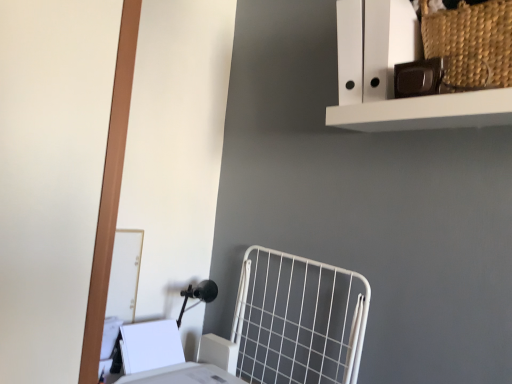
This screenshot has height=384, width=512. What do you see at coordinates (392, 76) in the screenshot?
I see `woven brown basket at upper right` at bounding box center [392, 76].

What are the coordinates of `woven brown basket at upper right` in the screenshot? It's located at (392, 76).

Find the location of a particular element. woven brown basket at upper right is located at coordinates (392, 76).